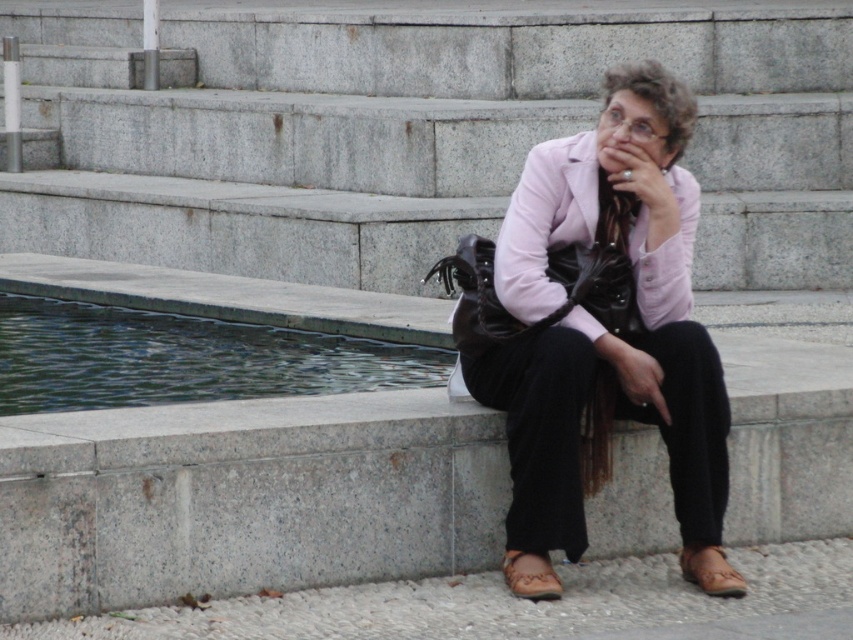
Question: Observing the image, what is the correct spatial positioning of matte pink blazer at center in reference to brown leather sandal at lower right?

Choices:
 (A) below
 (B) above

Answer: (B)

Question: Which of the following is the farthest from the observer?

Choices:
 (A) brown leather sandal at lower center
 (B) green reflective water at lower left
 (C) matte pink blazer at center

Answer: (B)

Question: Which point is closer to the camera taking this photo?

Choices:
 (A) (527, 227)
 (B) (701, 576)
 (C) (390, 365)

Answer: (A)

Question: Which object is closer to the camera taking this photo?

Choices:
 (A) brown leather sandal at lower right
 (B) brown leather sandal at lower center

Answer: (B)

Question: Observing the image, what is the correct spatial positioning of matte pink blazer at center in reference to brown leather sandal at lower right?

Choices:
 (A) right
 (B) left

Answer: (B)

Question: Does matte pink blazer at center appear under brown leather sandal at lower center?

Choices:
 (A) no
 (B) yes

Answer: (A)